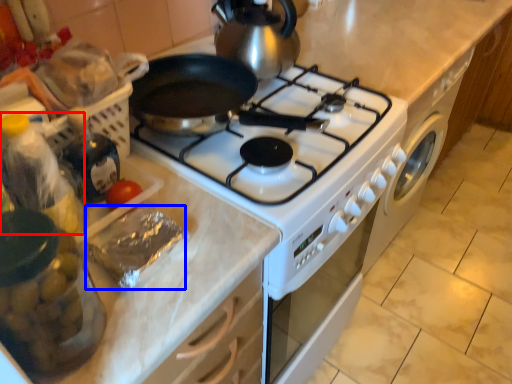
Question: Which point is closer to the camera, bottle (highlighted by a red box) or food (highlighted by a blue box)?

Choices:
 (A) bottle
 (B) food

Answer: (A)